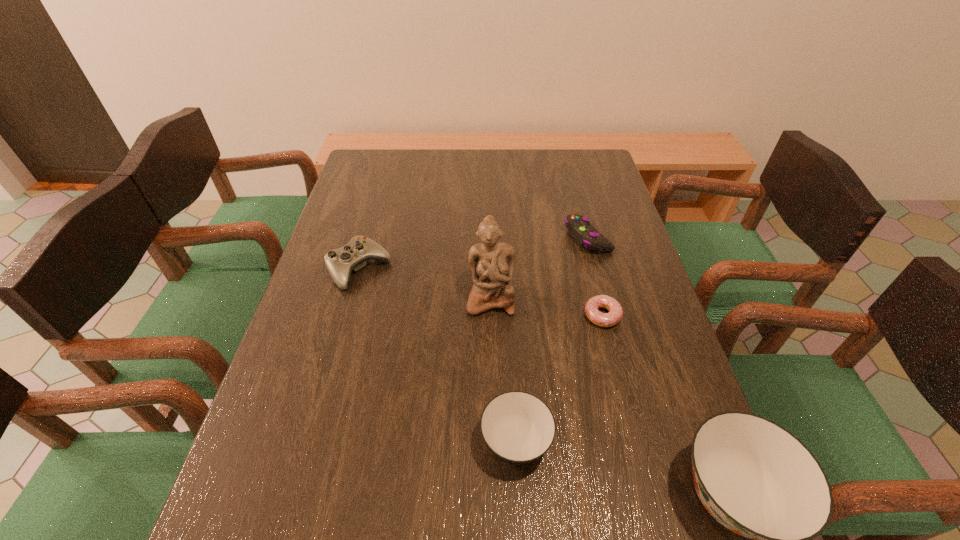
Identify the location of vacant space located 0.320m on the front of the left control. This screenshot has width=960, height=540. (322, 403).

Locate an element on the screen. The height and width of the screenshot is (540, 960). object that is at the near edge is located at coordinates (518, 427).

Where is `object at the left edge`? The width and height of the screenshot is (960, 540). object at the left edge is located at coordinates (340, 262).

In order to click on doughnut that is at the right edge in this screenshot , I will do `click(615, 314)`.

Identify the location of control that is at the right edge. This screenshot has width=960, height=540. (579, 227).

You are a GUI agent. You are given a task and a screenshot of the screen. Output one action in this format:
    pyautogui.click(x=<x>, y=<y>)
    Task: Click on the vacant space at the far edge
    The height and width of the screenshot is (540, 960).
    Given the screenshot: What is the action you would take?
    pyautogui.click(x=404, y=173)

Identify the location of vacant space at the near edge of the desktop. (x=570, y=477).

You are a GUI agent. You are given a task and a screenshot of the screen. Output one action in this format:
    pyautogui.click(x=<x>, y=<y>)
    Task: Click on the free space at the left edge of the desktop
    The width and height of the screenshot is (960, 540).
    Given the screenshot: What is the action you would take?
    pyautogui.click(x=318, y=311)

I want to click on vacant space at the right edge of the desktop, so click(637, 332).

This screenshot has height=540, width=960. Find the location of `vacant area at the far left corner of the desktop`. vacant area at the far left corner of the desktop is located at coordinates (377, 163).